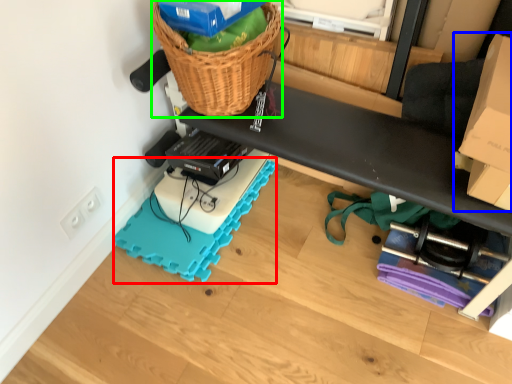
Question: Considering the real-world distances, which object is farthest from yoga mat (highlighted by a red box)? cardboard box (highlighted by a blue box) or basket (highlighted by a green box)?

Choices:
 (A) cardboard box
 (B) basket

Answer: (A)